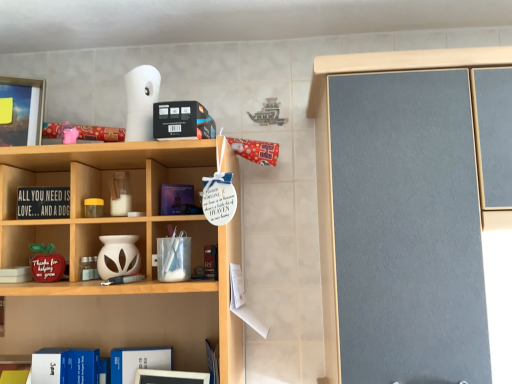
Question: Would you say white matte vase at center, marked as the 2th cabinet in a top-to-bottom arrangement, is part of blue hardcover book at lower left, acting as the second book starting from the top,'s contents?

Choices:
 (A) yes
 (B) no

Answer: (B)

Question: From the image's perspective, does blue hardcover book at lower left, which ranks as the 2th book in left-to-right order, appear lower than white matte vase at center, marked as the first cabinet in a bottom-to-top arrangement?

Choices:
 (A) yes
 (B) no

Answer: (A)

Question: Can you confirm if blue hardcover book at lower left, acting as the first book starting from the bottom, is wider than white matte vase at center, marked as the first cabinet in a bottom-to-top arrangement?

Choices:
 (A) no
 (B) yes

Answer: (A)

Question: Is blue hardcover book at lower left, which ranks as the 2th book in left-to-right order, outside of white matte vase at center, marked as the 2th cabinet in a top-to-bottom arrangement?

Choices:
 (A) no
 (B) yes

Answer: (B)

Question: Considering the relative positions of blue hardcover book at lower left, arranged as the first book when viewed from the right, and white matte vase at center, marked as the 2th cabinet in a top-to-bottom arrangement, in the image provided, is blue hardcover book at lower left, arranged as the first book when viewed from the right, to the right of white matte vase at center, marked as the 2th cabinet in a top-to-bottom arrangement, from the viewer's perspective?

Choices:
 (A) yes
 (B) no

Answer: (A)

Question: Visually, is white matte vase at center, marked as the 2th cabinet in a top-to-bottom arrangement, positioned to the left or to the right of clear glass jar at center, placed as the 1th cabinet when sorted from top to bottom?

Choices:
 (A) left
 (B) right

Answer: (A)

Question: Considering the positions of white matte vase at center, marked as the 2th cabinet in a top-to-bottom arrangement, and clear glass jar at center, placed as the 1th cabinet when sorted from top to bottom, in the image, is white matte vase at center, marked as the 2th cabinet in a top-to-bottom arrangement, taller or shorter than clear glass jar at center, placed as the 1th cabinet when sorted from top to bottom,?

Choices:
 (A) tall
 (B) short

Answer: (B)

Question: From the image's perspective, relative to clear glass jar at center, which appears as the 2th cabinet when ordered from the bottom, is white matte vase at center, marked as the 2th cabinet in a top-to-bottom arrangement, above or below?

Choices:
 (A) above
 (B) below

Answer: (B)

Question: Would you say white matte vase at center, marked as the 2th cabinet in a top-to-bottom arrangement, is inside or outside clear glass jar at center, which appears as the 2th cabinet when ordered from the bottom?

Choices:
 (A) inside
 (B) outside

Answer: (B)

Question: From a real-world perspective, is white matte vase at center, marked as the 2th cabinet in a top-to-bottom arrangement, positioned above or below black wood sign at left, the 2th book in the bottom-to-top sequence?

Choices:
 (A) below
 (B) above

Answer: (A)

Question: Looking at the image, does white matte vase at center, marked as the 2th cabinet in a top-to-bottom arrangement, seem bigger or smaller compared to black wood sign at left, acting as the first book starting from the top?

Choices:
 (A) small
 (B) big

Answer: (B)

Question: Does point (130, 248) appear closer or farther from the camera than point (34, 213)?

Choices:
 (A) farther
 (B) closer

Answer: (A)

Question: Is white matte vase at center, marked as the 2th cabinet in a top-to-bottom arrangement, wider or thinner than black wood sign at left, acting as the first book starting from the top?

Choices:
 (A) wide
 (B) thin

Answer: (A)

Question: From the image's perspective, is clear glass jar at center, which appears as the 2th cabinet when ordered from the bottom, located above or below white matte vase at center, marked as the first cabinet in a bottom-to-top arrangement?

Choices:
 (A) below
 (B) above

Answer: (B)

Question: In the image, is clear glass jar at center, placed as the 1th cabinet when sorted from top to bottom, positioned in front of or behind white matte vase at center, marked as the first cabinet in a bottom-to-top arrangement?

Choices:
 (A) front
 (B) behind

Answer: (B)